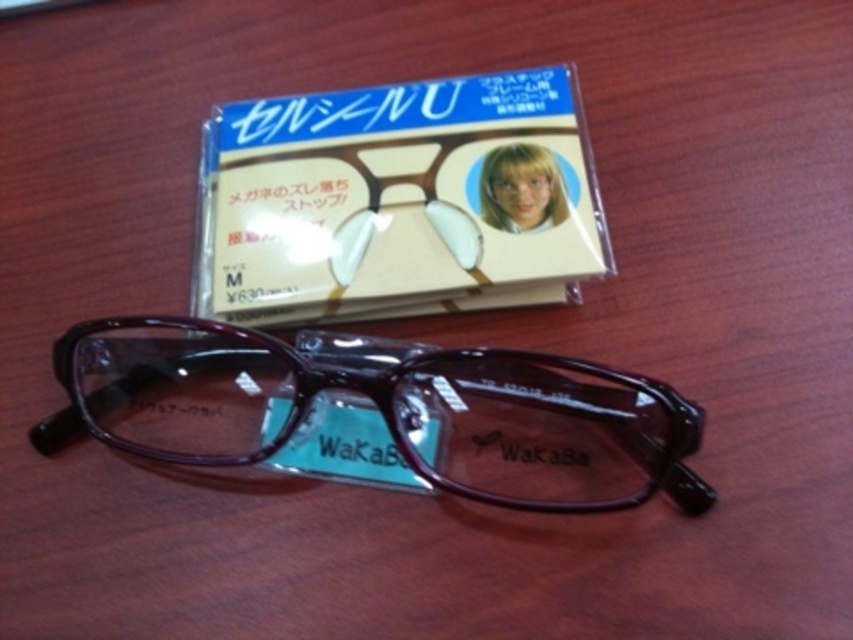
Question: Can you confirm if clear plastic case at upper center is positioned to the right of shiny brown glasses at center?

Choices:
 (A) no
 (B) yes

Answer: (B)

Question: Is clear plastic case at upper center closer to camera compared to shiny brown glasses at center?

Choices:
 (A) yes
 (B) no

Answer: (B)

Question: Among these objects, which one is nearest to the camera?

Choices:
 (A) shiny brown glasses at center
 (B) clear plastic case at upper center

Answer: (A)

Question: Does clear plastic case at upper center appear on the right side of shiny brown glasses at center?

Choices:
 (A) yes
 (B) no

Answer: (A)